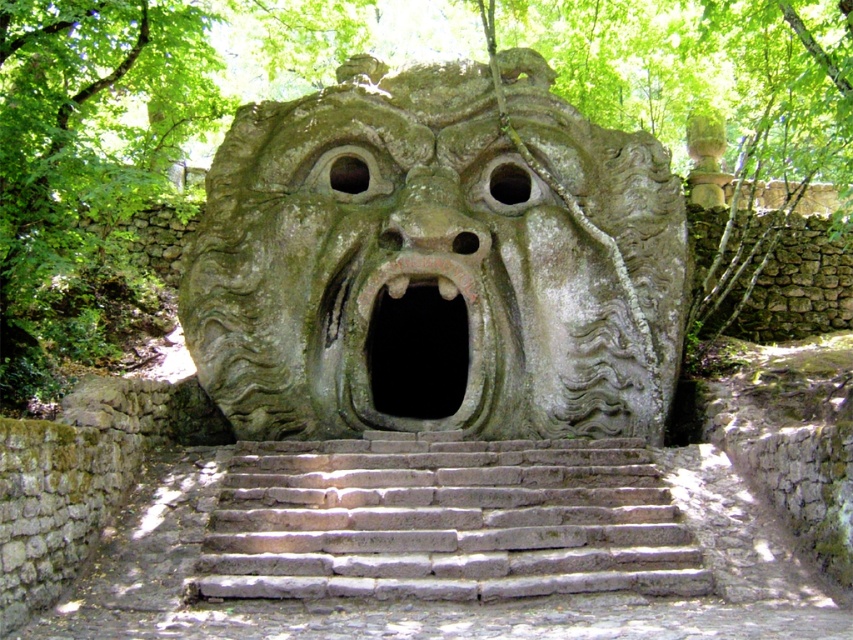
Between green stone face at center and rusty metal mouth at center, which one appears on the right side from the viewer's perspective?

Positioned to the right is green stone face at center.

Is green stone face at center smaller than rusty metal mouth at center?

No, green stone face at center is not smaller than rusty metal mouth at center.

Who is more distant from viewer, (451, 422) or (445, 392)?

The point (445, 392) is behind.

This screenshot has height=640, width=853. What are the coordinates of `green stone face at center` in the screenshot? It's located at point(436,262).

This screenshot has height=640, width=853. Describe the element at coordinates (436, 262) in the screenshot. I see `green stone face at center` at that location.

Can you confirm if green stone face at center is positioned above gray stone stairs at center?

Indeed, green stone face at center is positioned over gray stone stairs at center.

Identify the location of green stone face at center. (436, 262).

Find the location of `green stone face at center`. green stone face at center is located at coordinates (436, 262).

Between gray stone stairs at center and rusty metal mouth at center, which one has less height?

With less height is gray stone stairs at center.

Between gray stone stairs at center and rusty metal mouth at center, which one is positioned higher?

rusty metal mouth at center is higher up.

Between point (397, 582) and point (376, 321), which one is positioned in front?

Positioned in front is point (397, 582).

Find the location of `gray stone stairs at center`. gray stone stairs at center is located at coordinates (444, 522).